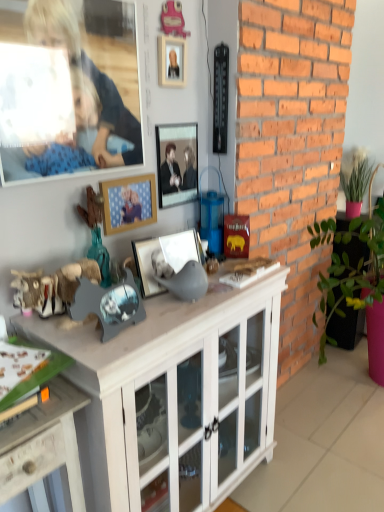
Question: Considering the relative positions of white wood cabinet at center and wooden photo frame at center, which appears as the 2th picture frame when viewed from the top, in the image provided, is white wood cabinet at center behind wooden photo frame at center, which appears as the 2th picture frame when viewed from the top,?

Choices:
 (A) no
 (B) yes

Answer: (A)

Question: Is white wood cabinet at center wider than wooden photo frame at center, arranged as the 2th picture frame when ordered from the bottom?

Choices:
 (A) yes
 (B) no

Answer: (A)

Question: Is white wood cabinet at center shorter than wooden photo frame at center, which appears as the 2th picture frame when viewed from the top?

Choices:
 (A) yes
 (B) no

Answer: (B)

Question: Is white wood cabinet at center turned away from wooden photo frame at center, which appears as the 2th picture frame when viewed from the top?

Choices:
 (A) yes
 (B) no

Answer: (B)

Question: Can you confirm if white wood cabinet at center is bigger than wooden photo frame at center, which appears as the 2th picture frame when viewed from the top?

Choices:
 (A) no
 (B) yes

Answer: (B)

Question: Relative to metallic silver picture frame at center, which is the third picture frame in bottom-to-top order, is smooth wooden frame at upper left in front or behind?

Choices:
 (A) behind
 (B) front

Answer: (B)

Question: Visually, is smooth wooden frame at upper left positioned to the left or to the right of metallic silver picture frame at center, which is the third picture frame in bottom-to-top order?

Choices:
 (A) left
 (B) right

Answer: (A)

Question: From the image's perspective, is smooth wooden frame at upper left above or below metallic silver picture frame at center, which is the third picture frame in bottom-to-top order?

Choices:
 (A) below
 (B) above

Answer: (B)

Question: From a real-world perspective, is smooth wooden frame at upper left positioned above or below metallic silver picture frame at center, placed as the first picture frame when sorted from top to bottom?

Choices:
 (A) below
 (B) above

Answer: (B)

Question: Do you think wooden desk at lower left is within matte silver picture frame at center, the 3th picture frame positioned from the top, or outside of it?

Choices:
 (A) outside
 (B) inside

Answer: (A)

Question: From the image's perspective, is wooden desk at lower left positioned above or below matte silver picture frame at center, the 3th picture frame positioned from the top?

Choices:
 (A) above
 (B) below

Answer: (B)

Question: Is point (51, 446) closer or farther from the camera than point (147, 244)?

Choices:
 (A) closer
 (B) farther

Answer: (A)

Question: From a real-world perspective, is wooden desk at lower left positioned above or below matte silver picture frame at center, the 3th picture frame positioned from the top?

Choices:
 (A) below
 (B) above

Answer: (A)

Question: Considering the positions of matte silver picture frame at center, the 3th picture frame positioned from the top, and white wood cabinet at center in the image, is matte silver picture frame at center, the 3th picture frame positioned from the top, taller or shorter than white wood cabinet at center?

Choices:
 (A) tall
 (B) short

Answer: (B)

Question: Would you say matte silver picture frame at center, the 3th picture frame positioned from the top, is inside or outside white wood cabinet at center?

Choices:
 (A) outside
 (B) inside

Answer: (A)